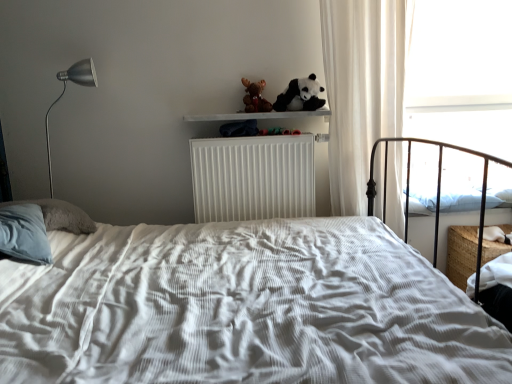
Question: Does transparent glass window at upper right have a smaller size compared to soft plush panda at upper center?

Choices:
 (A) no
 (B) yes

Answer: (A)

Question: Can you confirm if transparent glass window at upper right is positioned to the right of soft plush panda at upper center?

Choices:
 (A) yes
 (B) no

Answer: (A)

Question: Does transparent glass window at upper right have a larger size compared to soft plush panda at upper center?

Choices:
 (A) yes
 (B) no

Answer: (A)

Question: Could you tell me if transparent glass window at upper right is facing soft plush panda at upper center?

Choices:
 (A) no
 (B) yes

Answer: (A)

Question: Can soft plush panda at upper center be found inside transparent glass window at upper right?

Choices:
 (A) yes
 (B) no

Answer: (B)

Question: Considering the positions of point (470, 193) and point (421, 183), is point (470, 193) closer or farther from the camera than point (421, 183)?

Choices:
 (A) closer
 (B) farther

Answer: (A)

Question: From the image's perspective, is white soft pillow at right above or below transparent glass window at upper right?

Choices:
 (A) above
 (B) below

Answer: (B)

Question: From a real-world perspective, is white soft pillow at right above or below transparent glass window at upper right?

Choices:
 (A) below
 (B) above

Answer: (A)

Question: Choose the correct answer: Is white soft pillow at right inside transparent glass window at upper right or outside it?

Choices:
 (A) outside
 (B) inside

Answer: (A)

Question: From the image's perspective, relative to white ribbed radiator at center, is white wooden shelf at upper center above or below?

Choices:
 (A) below
 (B) above

Answer: (B)

Question: From their relative heights in the image, would you say white wooden shelf at upper center is taller or shorter than white ribbed radiator at center?

Choices:
 (A) tall
 (B) short

Answer: (B)

Question: Considering their positions, is white wooden shelf at upper center located in front of or behind white ribbed radiator at center?

Choices:
 (A) front
 (B) behind

Answer: (A)

Question: Would you say white wooden shelf at upper center is to the left or to the right of white ribbed radiator at center in the picture?

Choices:
 (A) right
 (B) left

Answer: (B)

Question: Is point (414, 127) closer or farther from the camera than point (343, 97)?

Choices:
 (A) farther
 (B) closer

Answer: (A)

Question: In the image, is transparent glass window at upper right positioned in front of or behind white sheer curtain at right?

Choices:
 (A) behind
 (B) front

Answer: (A)